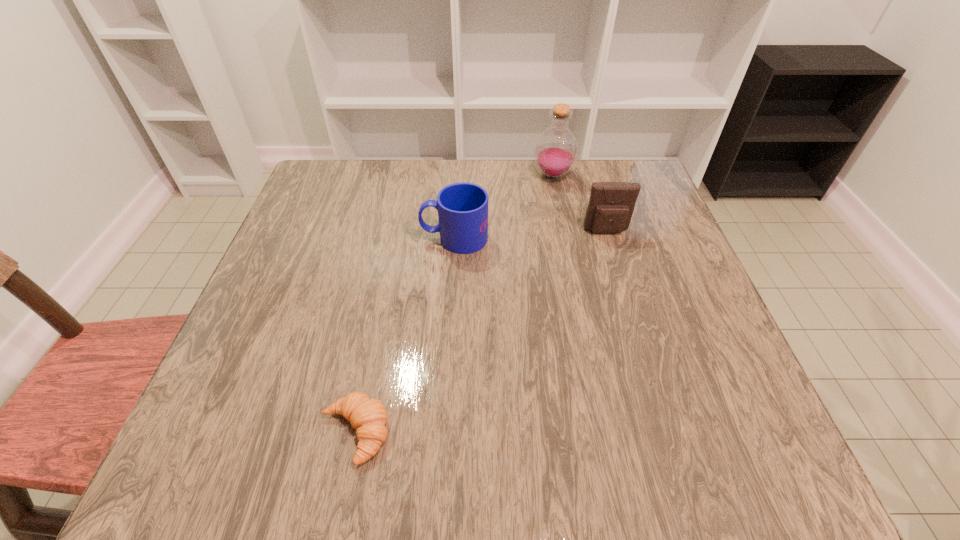
Identify the location of free space located 0.270m on the side with the handle of the third object from right to left. The height and width of the screenshot is (540, 960). (305, 238).

At what (x,y) coordinates should I click in order to perform the action: click on vacant space located 0.130m on the left of the shortest object. Please return your answer as a coordinate pair (x, y). The image size is (960, 540). Looking at the image, I should click on (238, 433).

At what (x,y) coordinates should I click in order to perform the action: click on object that is at the far edge. Please return your answer as a coordinate pair (x, y). The height and width of the screenshot is (540, 960). Looking at the image, I should click on (556, 149).

Locate an element on the screen. The width and height of the screenshot is (960, 540). object that is positioned at the near edge is located at coordinates (368, 416).

Identify the location of object that is at the right edge. (611, 205).

Identify the location of free space at the far edge of the desktop. The width and height of the screenshot is (960, 540). (445, 180).

The height and width of the screenshot is (540, 960). In the image, there is a desktop. What are the coordinates of `free region at the near edge` in the screenshot? It's located at (622, 438).

You are a GUI agent. You are given a task and a screenshot of the screen. Output one action in this format:
    pyautogui.click(x=<x>, y=<y>)
    Task: Click on the vacant space at the left edge of the desktop
    
    Given the screenshot: What is the action you would take?
    pyautogui.click(x=244, y=374)

The height and width of the screenshot is (540, 960). Find the location of `vacant space at the right edge of the desktop`. vacant space at the right edge of the desktop is located at coordinates pyautogui.click(x=693, y=364).

The height and width of the screenshot is (540, 960). I want to click on vacant space at the near left corner of the desktop, so click(245, 474).